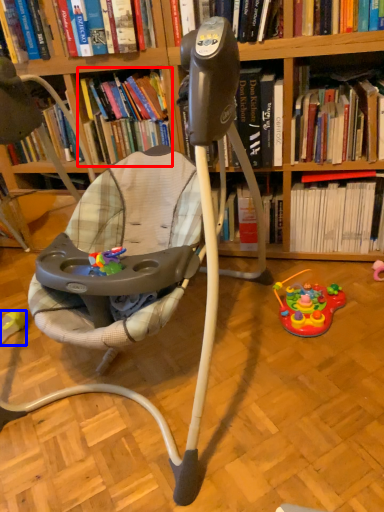
Question: Which of the following is the farthest to the observer, book (highlighted by a red box) or toy (highlighted by a blue box)?

Choices:
 (A) book
 (B) toy

Answer: (B)